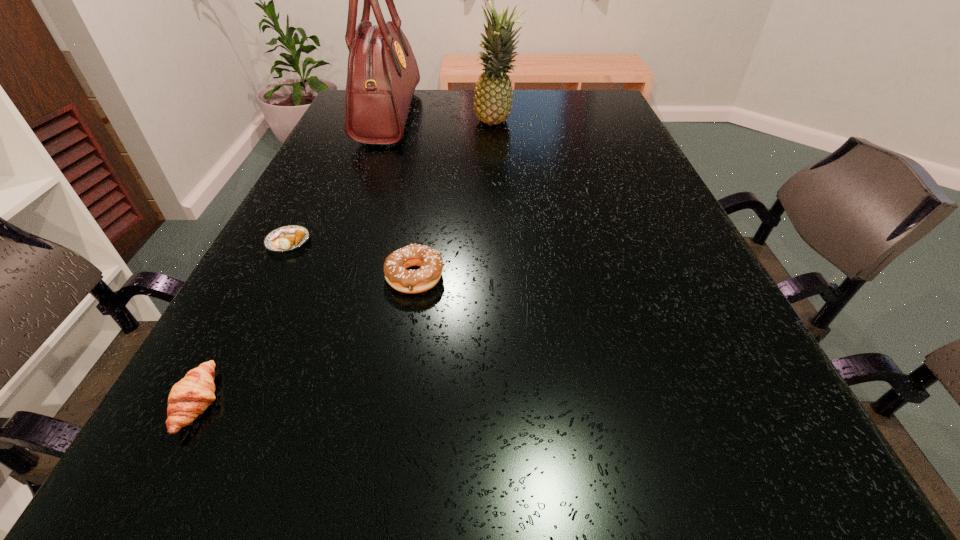
At what (x,y) coordinates should I click in order to perform the action: click on handbag. Please return your answer as a coordinate pair (x, y). The image size is (960, 540). Looking at the image, I should click on (383, 73).

Identify the location of pineapple. (493, 94).

At what (x,y) coordinates should I click in order to perform the action: click on the second tallest object. Please return your answer as a coordinate pair (x, y). The height and width of the screenshot is (540, 960). Looking at the image, I should click on (493, 94).

Find the location of `doughnut`. doughnut is located at coordinates (430, 261).

Where is `the second object from right to left`? The image size is (960, 540). the second object from right to left is located at coordinates (430, 261).

You are a GUI agent. You are given a task and a screenshot of the screen. Output one action in this format:
    pyautogui.click(x=<x>, y=<y>)
    Task: Click on the nearer pastry
    
    Given the screenshot: What is the action you would take?
    pyautogui.click(x=189, y=398)

This screenshot has width=960, height=540. In order to click on the taller pastry in this screenshot , I will do `click(189, 398)`.

The height and width of the screenshot is (540, 960). In order to click on the third farthest object in this screenshot , I will do `click(286, 238)`.

Image resolution: width=960 pixels, height=540 pixels. Find the location of `the farther pastry`. the farther pastry is located at coordinates (286, 238).

Identify the location of vacant space located on the front-facing side of the handbag. (470, 116).